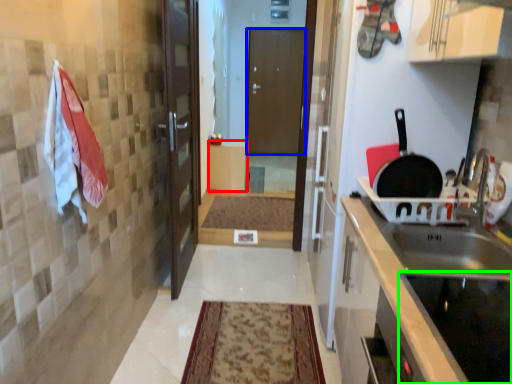
Question: Estimate the real-world distances between objects in this image. Which object is farther from cabinetry (highlighted by a red box), door (highlighted by a blue box) or appliance (highlighted by a green box)?

Choices:
 (A) door
 (B) appliance

Answer: (B)